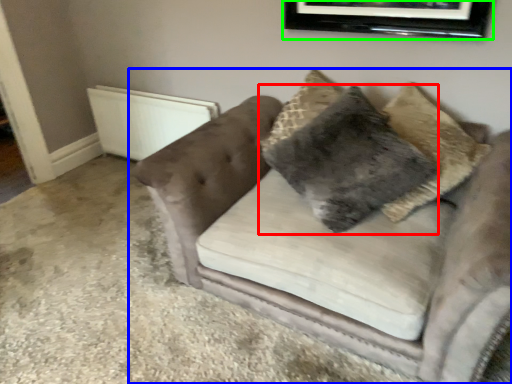
Question: Estimate the real-world distances between objects in this image. Which object is closer to pillow (highlighted by a red box), studio couch (highlighted by a blue box) or picture frame (highlighted by a green box)?

Choices:
 (A) studio couch
 (B) picture frame

Answer: (A)